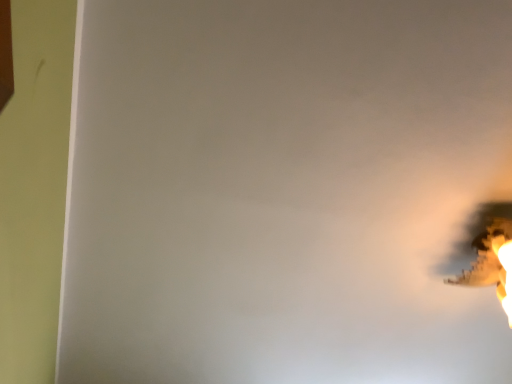
What do you see at coordinates (492, 254) in the screenshot? I see `wooden puzzle piece at right` at bounding box center [492, 254].

Image resolution: width=512 pixels, height=384 pixels. I want to click on wooden puzzle piece at right, so click(x=492, y=254).

This screenshot has height=384, width=512. I want to click on wooden puzzle piece at right, so click(x=492, y=254).